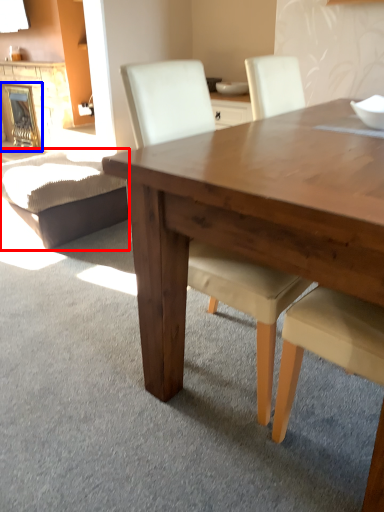
Question: Which point is closer to the camera, swivel chair (highlighted by a red box) or fireplace (highlighted by a blue box)?

Choices:
 (A) swivel chair
 (B) fireplace

Answer: (A)